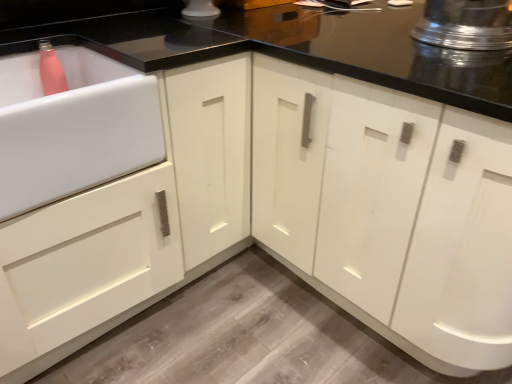
Question: Is white glossy sink at left positioned behind white glossy cabinet at center?

Choices:
 (A) no
 (B) yes

Answer: (B)

Question: Considering the relative sizes of white glossy sink at left and white glossy cabinet at center in the image provided, is white glossy sink at left wider than white glossy cabinet at center?

Choices:
 (A) yes
 (B) no

Answer: (B)

Question: Is white glossy sink at left turned away from white glossy cabinet at center?

Choices:
 (A) yes
 (B) no

Answer: (B)

Question: Does white glossy sink at left have a smaller size compared to white glossy cabinet at center?

Choices:
 (A) no
 (B) yes

Answer: (B)

Question: Is white glossy sink at left located outside white glossy cabinet at center?

Choices:
 (A) no
 (B) yes

Answer: (B)

Question: Considering the relative sizes of white glossy sink at left and white glossy cabinet at center in the image provided, is white glossy sink at left taller than white glossy cabinet at center?

Choices:
 (A) yes
 (B) no

Answer: (B)

Question: Would you say white glossy cabinet at center is a long distance from shiny metallic pot at upper right?

Choices:
 (A) yes
 (B) no

Answer: (B)

Question: Does white glossy cabinet at center have a lesser height compared to shiny metallic pot at upper right?

Choices:
 (A) no
 (B) yes

Answer: (A)

Question: Would you say white glossy cabinet at center is outside shiny metallic pot at upper right?

Choices:
 (A) no
 (B) yes

Answer: (B)

Question: Is the surface of white glossy cabinet at center in direct contact with shiny metallic pot at upper right?

Choices:
 (A) no
 (B) yes

Answer: (A)

Question: Is white glossy cabinet at center further to the viewer compared to shiny metallic pot at upper right?

Choices:
 (A) no
 (B) yes

Answer: (A)

Question: From the image's perspective, is white glossy cabinet at center over shiny metallic pot at upper right?

Choices:
 (A) yes
 (B) no

Answer: (B)

Question: Is shiny metallic pot at upper right directly adjacent to white glossy sink at left?

Choices:
 (A) no
 (B) yes

Answer: (A)